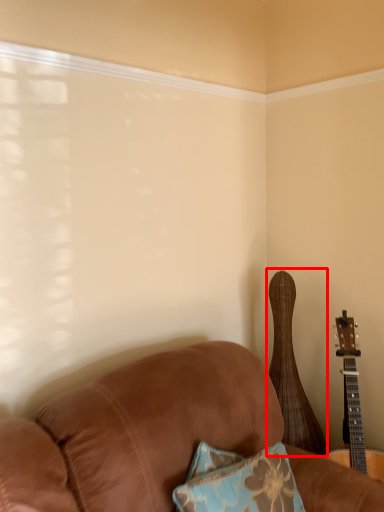
Question: From the image's perspective, where is guitar (annotated by the red box) located relative to guitar?

Choices:
 (A) below
 (B) above

Answer: (B)